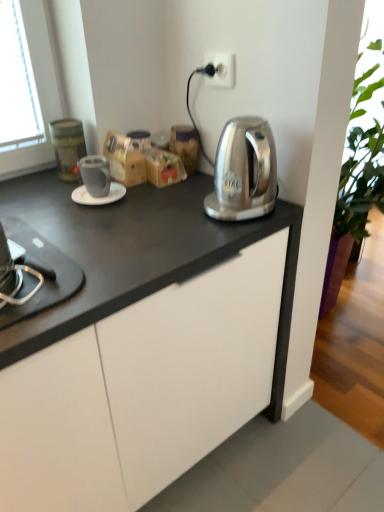
Identify the location of vacant space that is in between satin silver kettle at center and white glossy saucer at center. (163, 207).